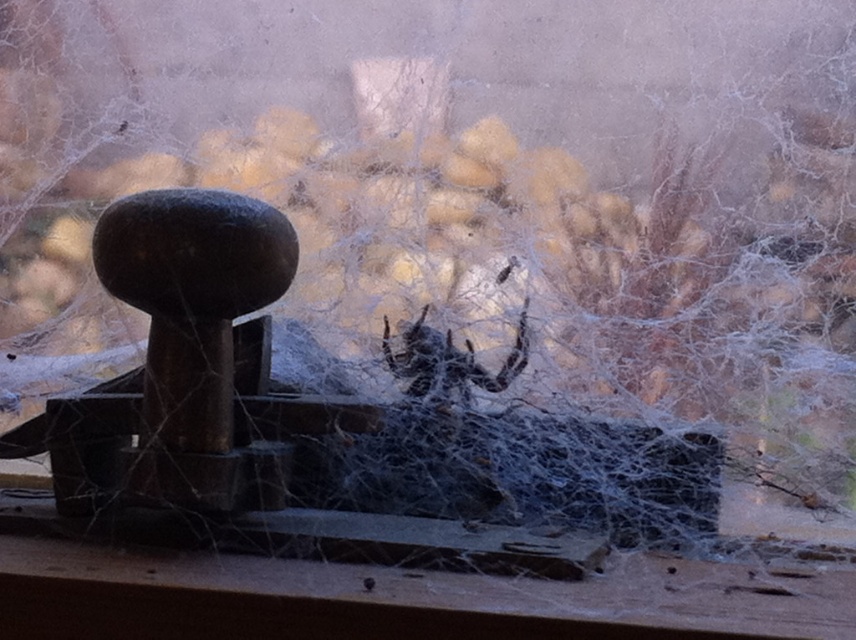
Question: Does wooden at lower center appear on the left side of dark brown fuzzy spider at center?

Choices:
 (A) no
 (B) yes

Answer: (B)

Question: Which of the following is the farthest from the observer?

Choices:
 (A) [x=456, y=593]
 (B) [x=503, y=364]

Answer: (B)

Question: Can you confirm if wooden at lower center is thinner than dark brown fuzzy spider at center?

Choices:
 (A) yes
 (B) no

Answer: (B)

Question: Is wooden at lower center closer to the viewer compared to dark brown fuzzy spider at center?

Choices:
 (A) no
 (B) yes

Answer: (B)

Question: Which object appears closest to the camera in this image?

Choices:
 (A) dark brown fuzzy spider at center
 (B) wooden at lower center

Answer: (B)

Question: Among these objects, which one is nearest to the camera?

Choices:
 (A) wooden at lower center
 (B) dark brown fuzzy spider at center

Answer: (A)